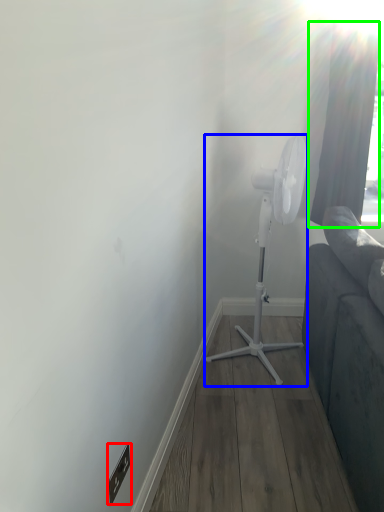
Question: Considering the real-world distances, which object is closest to electric outlet (highlighted by a red box)? mechanical fan (highlighted by a blue box) or curtain (highlighted by a green box).

Choices:
 (A) mechanical fan
 (B) curtain

Answer: (A)